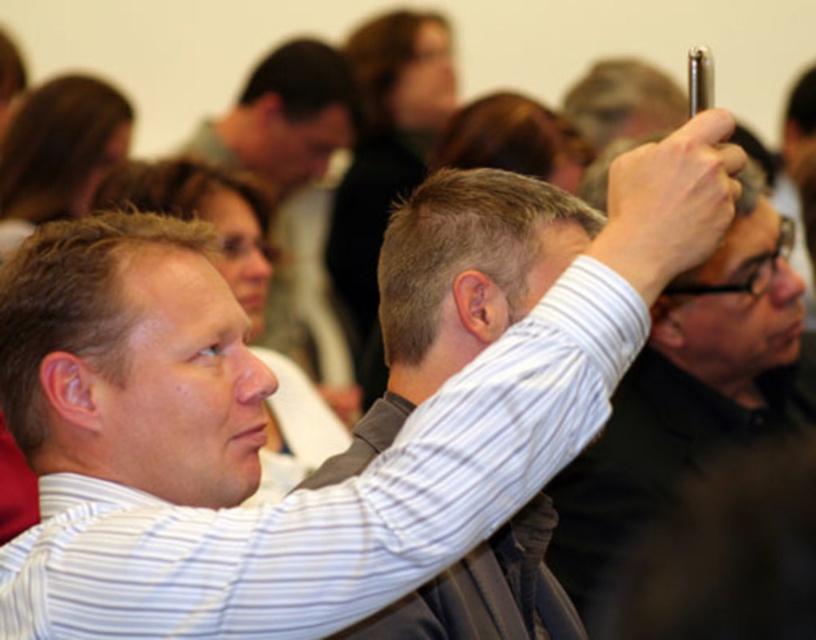
Question: Which point is closer to the camera?

Choices:
 (A) (433, 218)
 (B) (7, 408)

Answer: (B)

Question: Among these objects, which one is nearest to the camera?

Choices:
 (A) white striped shirt at upper center
 (B) short blonde hair at upper center
 (C) light brown hair at center

Answer: (C)

Question: Which is farther from the white striped shirt at upper center?

Choices:
 (A) light brown hair at center
 (B) short blonde hair at upper center

Answer: (A)

Question: Can you confirm if light brown hair at center is wider than short blonde hair at upper center?

Choices:
 (A) yes
 (B) no

Answer: (B)

Question: Does white striped shirt at upper center appear under light brown hair at center?

Choices:
 (A) no
 (B) yes

Answer: (B)

Question: Where is light brown hair at center located in relation to short blonde hair at upper center in the image?

Choices:
 (A) below
 (B) above

Answer: (A)